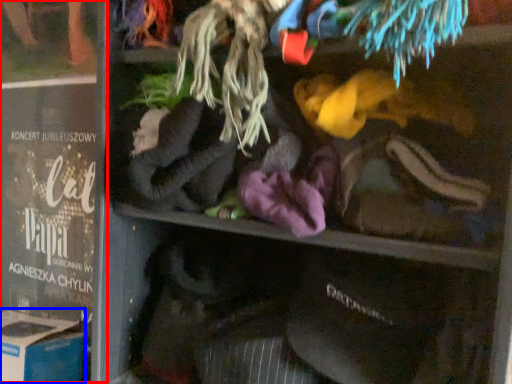
Question: Which of the following is the farthest to the observer, book (highlighted by a red box) or cardboard box (highlighted by a blue box)?

Choices:
 (A) book
 (B) cardboard box

Answer: (A)